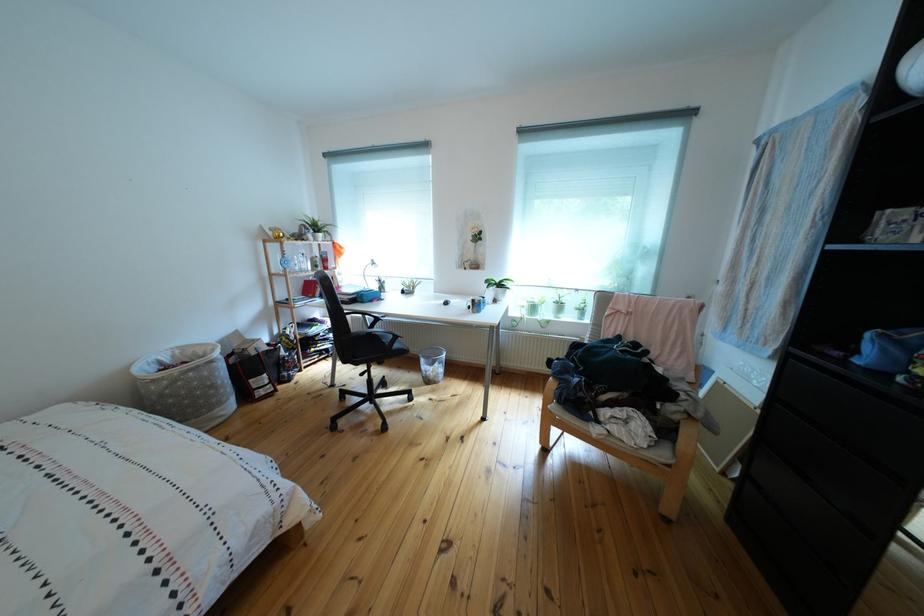
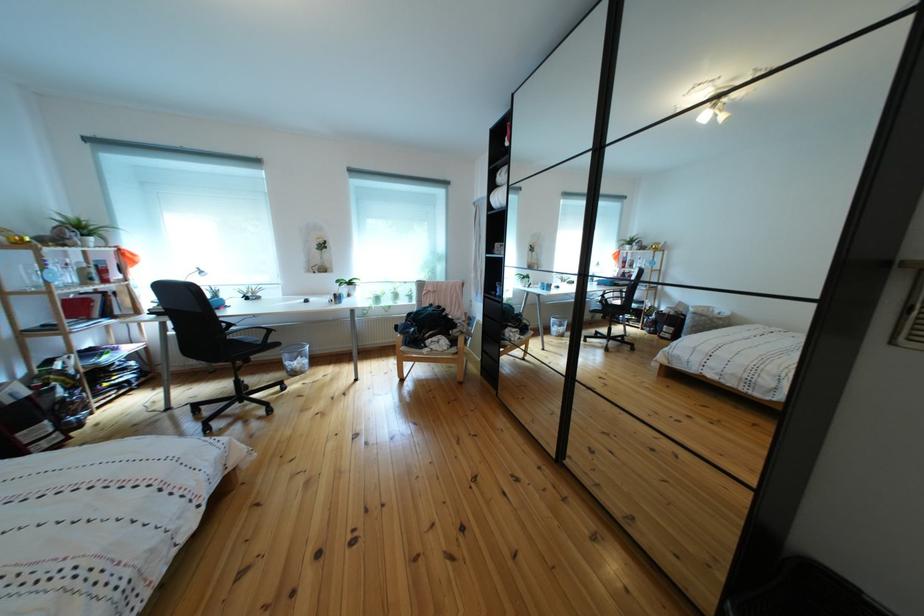
Where in the second image is the point corresponding to (662,435) from the first image?

(458, 347)